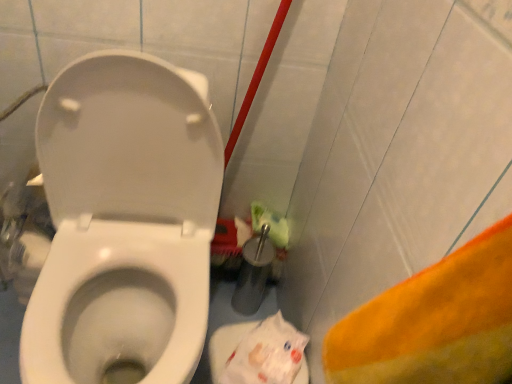
Question: Is white glossy toilet at center smaller than white plastic bag at lower right?

Choices:
 (A) yes
 (B) no

Answer: (B)

Question: Can you confirm if white glossy toilet at center is bigger than white plastic bag at lower right?

Choices:
 (A) yes
 (B) no

Answer: (A)

Question: Considering the relative sizes of white glossy toilet at center and white plastic bag at lower right in the image provided, is white glossy toilet at center thinner than white plastic bag at lower right?

Choices:
 (A) yes
 (B) no

Answer: (B)

Question: Can you confirm if white glossy toilet at center is positioned to the left of white plastic bag at lower right?

Choices:
 (A) yes
 (B) no

Answer: (A)

Question: Would you say white glossy toilet at center is outside white plastic bag at lower right?

Choices:
 (A) no
 (B) yes

Answer: (B)

Question: Would you say white glossy toilet at center is a long distance from white plastic bag at lower right?

Choices:
 (A) yes
 (B) no

Answer: (B)

Question: From a real-world perspective, is white plastic bag at lower right on top of white glossy toilet at center?

Choices:
 (A) no
 (B) yes

Answer: (A)

Question: From the image's perspective, is white plastic bag at lower right under white glossy toilet at center?

Choices:
 (A) yes
 (B) no

Answer: (A)

Question: Considering the relative sizes of white plastic bag at lower right and white glossy toilet at center in the image provided, is white plastic bag at lower right wider than white glossy toilet at center?

Choices:
 (A) no
 (B) yes

Answer: (A)

Question: Is white plastic bag at lower right with white glossy toilet at center?

Choices:
 (A) no
 (B) yes

Answer: (A)

Question: Considering the relative positions of white plastic bag at lower right and white glossy toilet at center in the image provided, is white plastic bag at lower right behind white glossy toilet at center?

Choices:
 (A) no
 (B) yes

Answer: (B)

Question: Considering the relative sizes of white plastic bag at lower right and white glossy toilet at center in the image provided, is white plastic bag at lower right bigger than white glossy toilet at center?

Choices:
 (A) no
 (B) yes

Answer: (A)

Question: Is white glossy toilet at center wider or thinner than white plastic bag at lower right?

Choices:
 (A) wide
 (B) thin

Answer: (A)